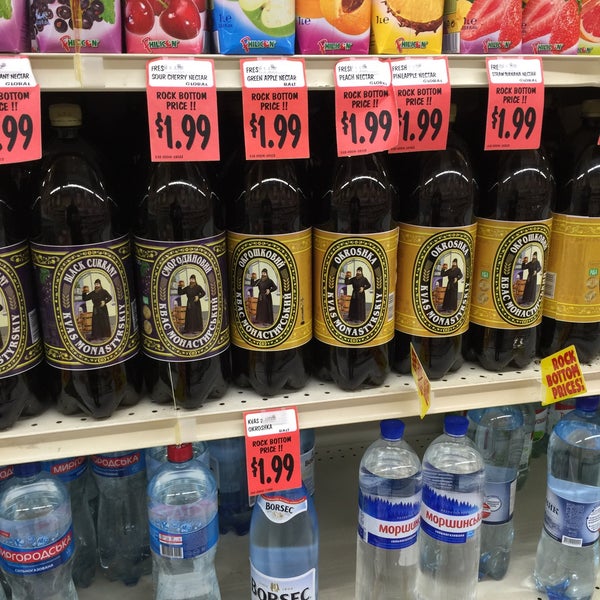
The width and height of the screenshot is (600, 600). What are the coordinates of `bottle` in the screenshot? It's located at (355, 364).